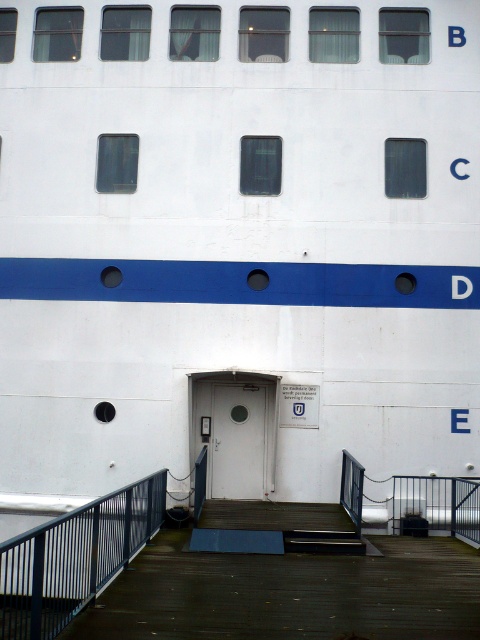
Which is in front, point (67, 596) or point (344, 548)?

Point (67, 596)

Between point (122, 515) and point (228, 518), which one is positioned in front?

Positioned in front is point (122, 515).

Locate an element on the screen. The image size is (480, 640). blue metal railing at lower left is located at coordinates (73, 557).

Between blue metal railing at lower left and white matte door at center, which one is positioned lower?

white matte door at center is lower down.

Who is more distant from viewer, (130,499) or (222,435)?

The point (222,435) is more distant.

Is point (61, 593) farther from viewer compared to point (264, 444)?

No, (61, 593) is closer to viewer.

Locate an element on the screen. The image size is (480, 640). blue metal railing at lower left is located at coordinates (73, 557).

Can you confirm if wooden deck stairs at center is positioned above white matte door at center?

No.

Between wooden deck stairs at center and white matte door at center, which one is positioned higher?

white matte door at center is higher up.

What are the coordinates of `wooden deck stairs at center` in the screenshot? It's located at (275, 528).